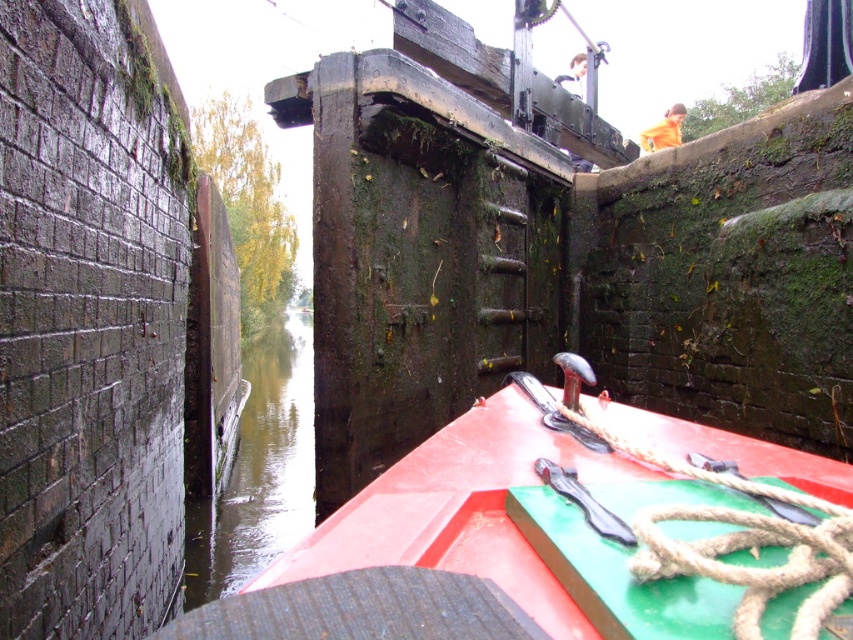
You are a sailor on a boat passing through a narrow canal lock. You need to secure the roperoughrope at center to the cleat on the right wall. Can you reach the cleat from your current position near the greenish water at center without moving?

The roperoughrope at center is positioned on the right side of the greenish water at center, so if the cleat is on the right wall, the sailor can likely reach it by extending the rope from their position near the greenish water at center.

You are an observer standing on the deck of the red matte boat at center in the canal lock. You notice the greenish water at center ahead. Which object is nearer to you as you look forward?

The red matte boat at center is closer to you than the greenish water at center because you are on the boat itself, and the water is part of the environment ahead.